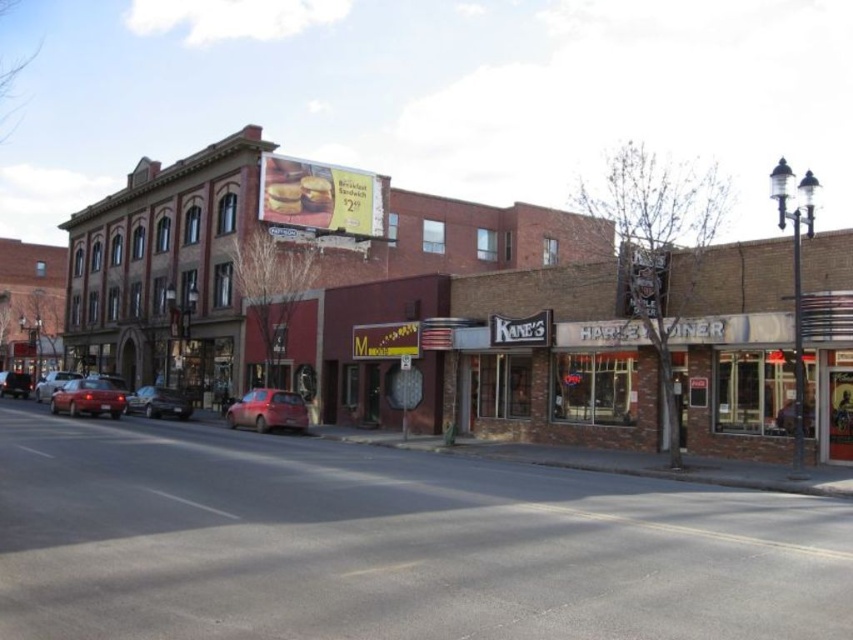
Question: Can you confirm if matte silver sedan at left is positioned to the right of matte red car at center?

Choices:
 (A) yes
 (B) no

Answer: (A)

Question: Which point is farther to the camera?

Choices:
 (A) brick building at center
 (B) matte red sedan at lower left
 (C) matte silver sedan at left
 (D) shiny black sedan at center-left

Answer: (C)

Question: Which of these objects is positioned closest to the matte red car at center?

Choices:
 (A) brick building at center
 (B) shiny black sedan at center-left
 (C) matte red hatchback at center
 (D) brick facade diner at center

Answer: (B)

Question: Does brick facade diner at center have a greater width compared to matte silver sedan at left?

Choices:
 (A) yes
 (B) no

Answer: (B)

Question: Which point appears closest to the camera in this image?

Choices:
 (A) (810, 385)
 (B) (65, 392)
 (C) (12, 385)
 (D) (653, 433)

Answer: (A)

Question: Observing the image, what is the correct spatial positioning of matte red hatchback at center in reference to matte red sedan at lower left?

Choices:
 (A) left
 (B) right

Answer: (B)